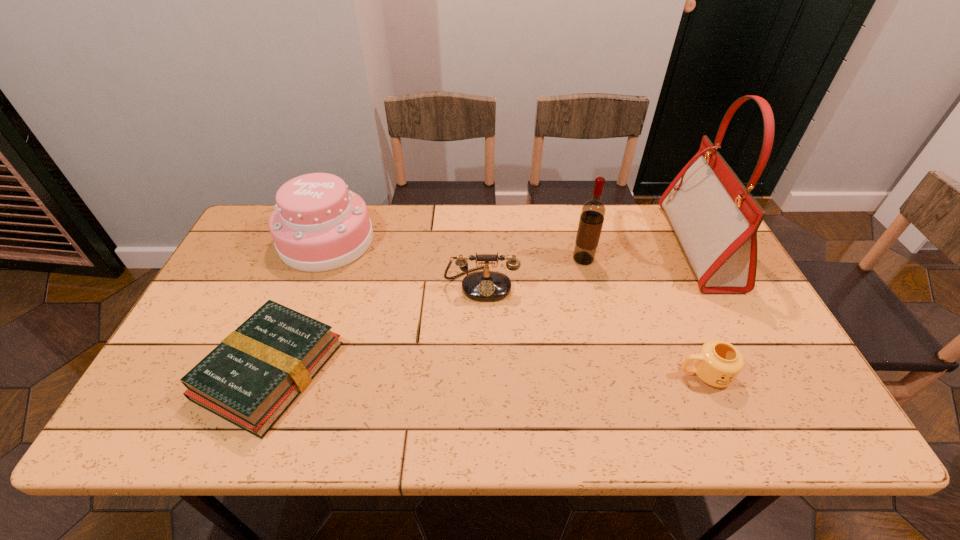
The height and width of the screenshot is (540, 960). In order to click on free space between the third shortest object and the third tallest object in this screenshot , I will do pyautogui.click(x=404, y=262).

The image size is (960, 540). I want to click on blank region between the shortest object and the mug, so click(x=487, y=372).

Locate which object is the fifth closest to the birthday cake. Please provide its 2D coordinates. Your answer should be formatted as a tuple, i.e. [(x, y)], where the tuple contains the x and y coordinates of a point satisfying the conditions above.

[(715, 218)]

Identify which object is the fifth nearest to the fourth object from right to left. Please provide its 2D coordinates. Your answer should be formatted as a tuple, i.e. [(x, y)], where the tuple contains the x and y coordinates of a point satisfying the conditions above.

[(715, 218)]

The width and height of the screenshot is (960, 540). Find the location of `free spot that satisfies the following two spatial constraints: 1. on the front side of the birthday cake; 2. on the left side of the fifth shortest object`. free spot that satisfies the following two spatial constraints: 1. on the front side of the birthday cake; 2. on the left side of the fifth shortest object is located at coordinates (320, 259).